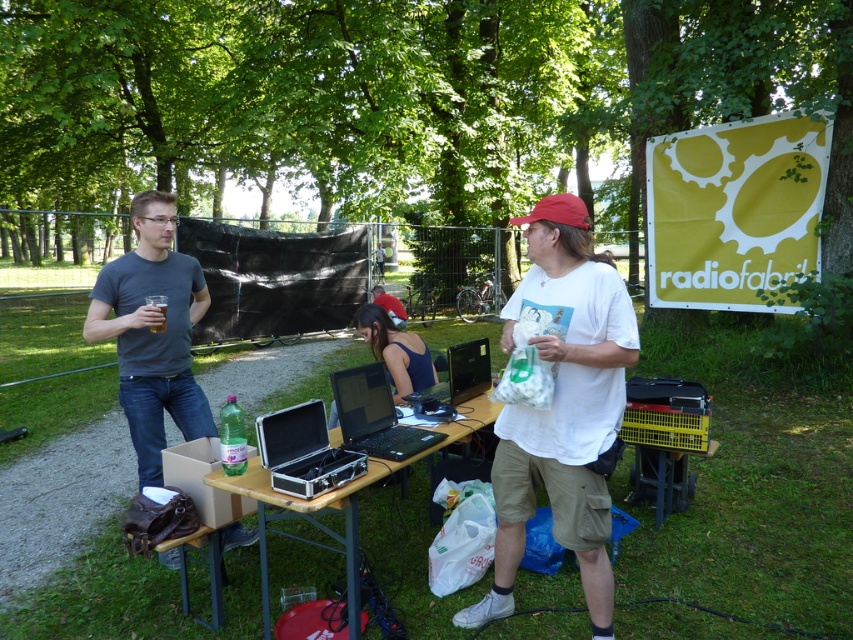
What is located at the coordinates point (374, 416)?

The black plastic laptop at center is located at point (374, 416).